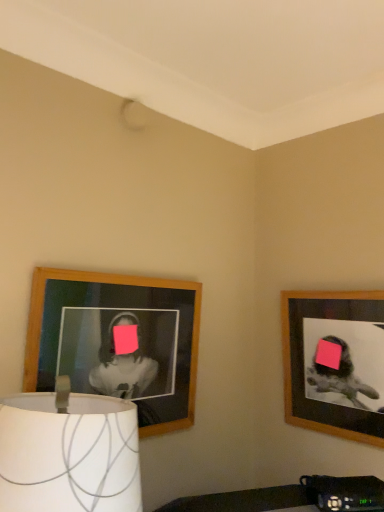
Question: Does white fabric lampshade at lower left turn towards wooden frame at upper right, the 1th picture frame positioned from the right?

Choices:
 (A) no
 (B) yes

Answer: (A)

Question: From the image's perspective, is white fabric lampshade at lower left on top of wooden frame at upper right, the 1th picture frame positioned from the right?

Choices:
 (A) no
 (B) yes

Answer: (A)

Question: From a real-world perspective, is white fabric lampshade at lower left over wooden frame at upper right, the 1th picture frame positioned from the right?

Choices:
 (A) yes
 (B) no

Answer: (B)

Question: Is white fabric lampshade at lower left turned away from wooden frame at upper right, the 1th picture frame positioned from the right?

Choices:
 (A) yes
 (B) no

Answer: (B)

Question: Does white fabric lampshade at lower left contain wooden frame at upper right, which is the second picture frame from left to right?

Choices:
 (A) no
 (B) yes

Answer: (A)

Question: Is point (122, 350) closer or farther from the camera than point (301, 353)?

Choices:
 (A) closer
 (B) farther

Answer: (A)

Question: Based on their positions, is wooden picture frame at left, which is the first picture frame from left to right, located to the left or right of wooden frame at upper right, which is the second picture frame from left to right?

Choices:
 (A) left
 (B) right

Answer: (A)

Question: In the image, is wooden picture frame at left, which is the first picture frame from left to right, positioned in front of or behind wooden frame at upper right, the 1th picture frame positioned from the right?

Choices:
 (A) front
 (B) behind

Answer: (A)

Question: From the image's perspective, is wooden picture frame at left, arranged as the 2th picture frame when viewed from the right, above or below wooden frame at upper right, the 1th picture frame positioned from the right?

Choices:
 (A) above
 (B) below

Answer: (A)

Question: In the image, is white fabric lampshade at lower left on the left side or the right side of wooden frame at upper right, which is the second picture frame from left to right?

Choices:
 (A) right
 (B) left

Answer: (B)

Question: From the image's perspective, is white fabric lampshade at lower left positioned above or below wooden frame at upper right, which is the second picture frame from left to right?

Choices:
 (A) below
 (B) above

Answer: (A)

Question: Is white fabric lampshade at lower left inside or outside of wooden frame at upper right, the 1th picture frame positioned from the right?

Choices:
 (A) inside
 (B) outside

Answer: (B)

Question: Is white fabric lampshade at lower left in front of or behind wooden frame at upper right, which is the second picture frame from left to right, in the image?

Choices:
 (A) behind
 (B) front

Answer: (B)

Question: Based on their sizes in the image, would you say white fabric lampshade at lower left is bigger or smaller than wooden picture frame at left, arranged as the 2th picture frame when viewed from the right?

Choices:
 (A) big
 (B) small

Answer: (A)

Question: From a real-world perspective, relative to wooden picture frame at left, arranged as the 2th picture frame when viewed from the right, is white fabric lampshade at lower left vertically above or below?

Choices:
 (A) above
 (B) below

Answer: (B)